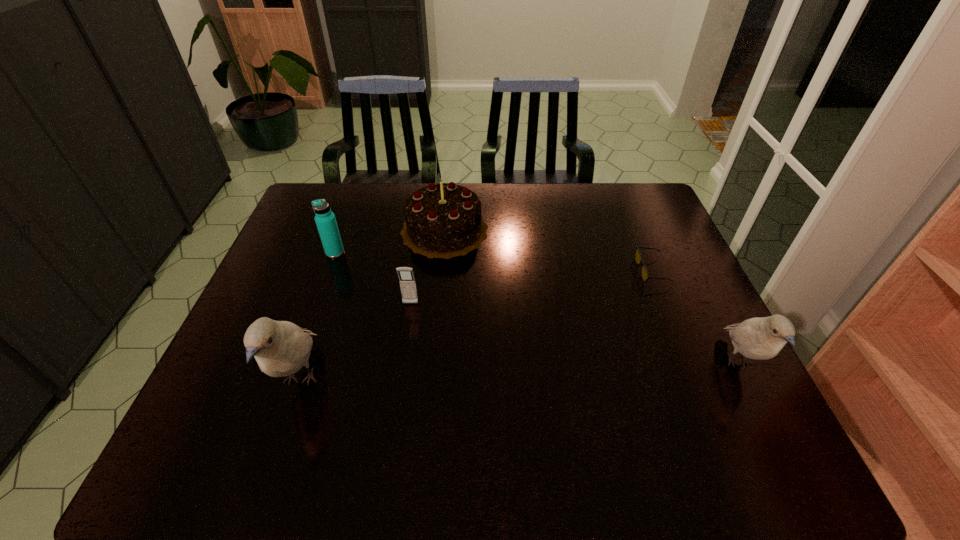
Find the location of a particular element. The image size is (960, 540). free space located on the right of the birthday cake is located at coordinates (541, 230).

This screenshot has width=960, height=540. I want to click on vacant space situated on the front of the water bottle, so click(326, 278).

Where is `vacant space located 0.190m on the front-facing side of the fifth tallest object`? vacant space located 0.190m on the front-facing side of the fifth tallest object is located at coordinates (400, 367).

At what (x,y) coordinates should I click in order to perform the action: click on vacant space located 0.390m on the front-facing side of the fifth object from left to right. Please return your answer as a coordinate pair (x, y). Looking at the image, I should click on (503, 271).

The height and width of the screenshot is (540, 960). What are the coordinates of `free point located 0.210m on the front-facing side of the fifth object from left to right` in the screenshot? It's located at (565, 271).

Where is `vacant area situated 0.110m on the front-facing side of the fifth object from left to right`? The height and width of the screenshot is (540, 960). vacant area situated 0.110m on the front-facing side of the fifth object from left to right is located at coordinates (601, 271).

At what (x,y) coordinates should I click in order to perform the action: click on object that is positioned at the far edge. Please return your answer as a coordinate pair (x, y). The image size is (960, 540). Looking at the image, I should click on (442, 220).

The height and width of the screenshot is (540, 960). In order to click on bird that is positioned at the left edge in this screenshot , I will do `click(281, 348)`.

Locate an element on the screen. water bottle present at the left edge is located at coordinates (325, 220).

The image size is (960, 540). Find the location of `bird located in the right edge section of the desktop`. bird located in the right edge section of the desktop is located at coordinates (761, 338).